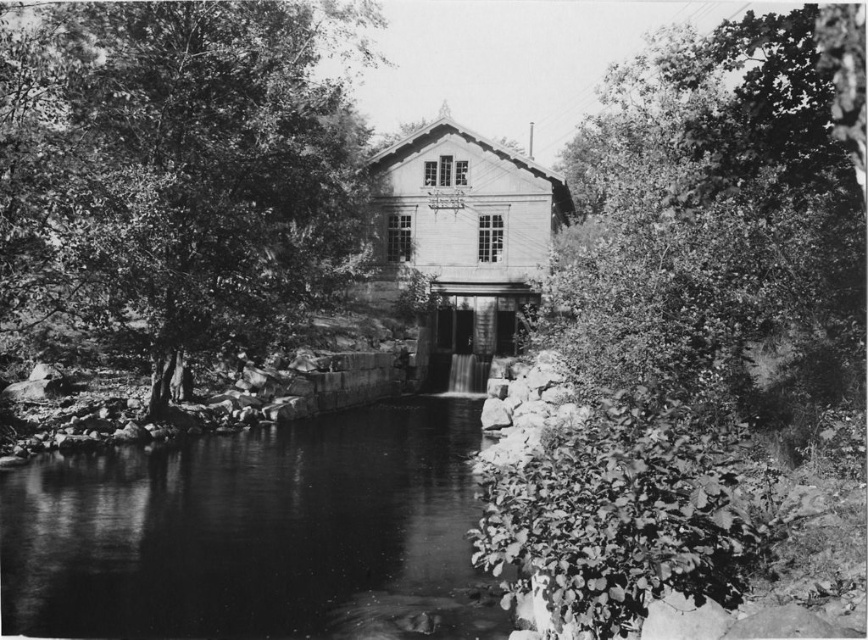
You are standing in front of the water mill and notice a smooth bark tree at center and thick green foliage at right. Which object is closer to you?

The smooth bark tree at center is closer to you because the thick green foliage at right is behind it.

You are standing in front of the water mill and notice a smooth bark tree at center and thick green foliage at right. Which object is positioned higher in the scene?

The smooth bark tree at center is positioned higher than the thick green foliage at right.